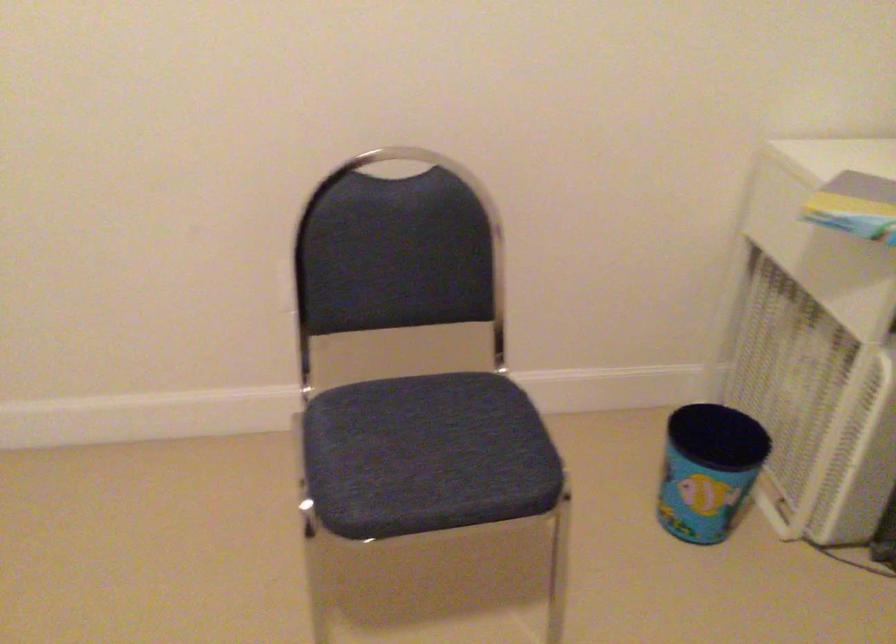
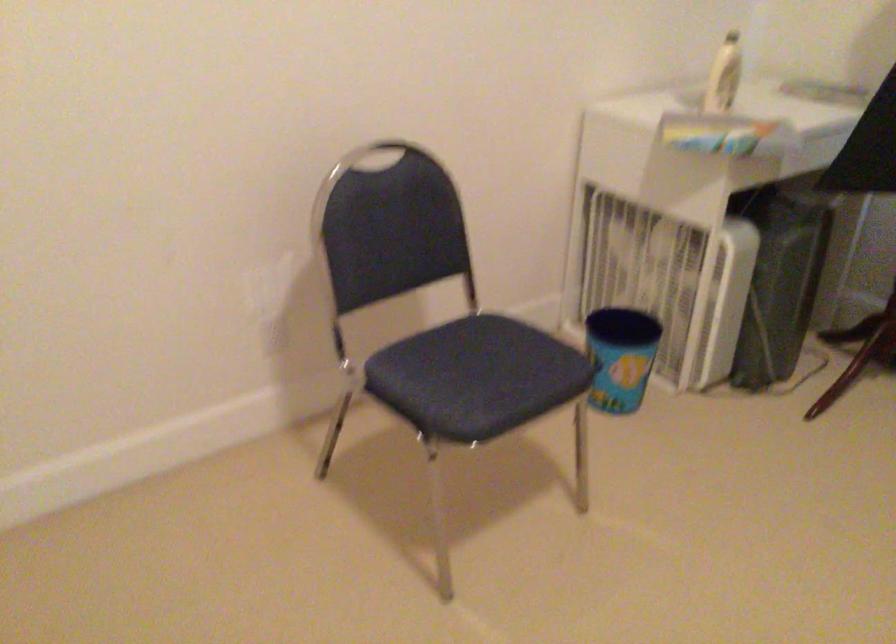
Where in the second image is the point corresponding to point 695,474 from the first image?

(619, 357)